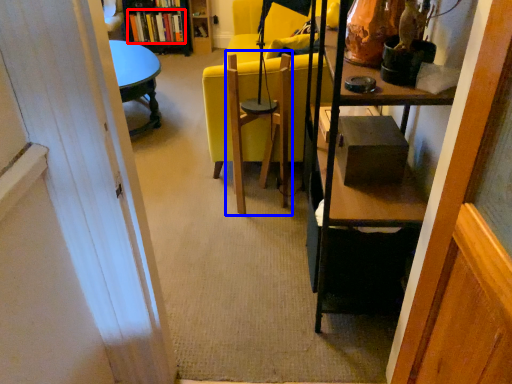
Question: Which object appears closest to the camera in this image, book (highlighted by a red box) or swivel chair (highlighted by a blue box)?

Choices:
 (A) book
 (B) swivel chair

Answer: (B)